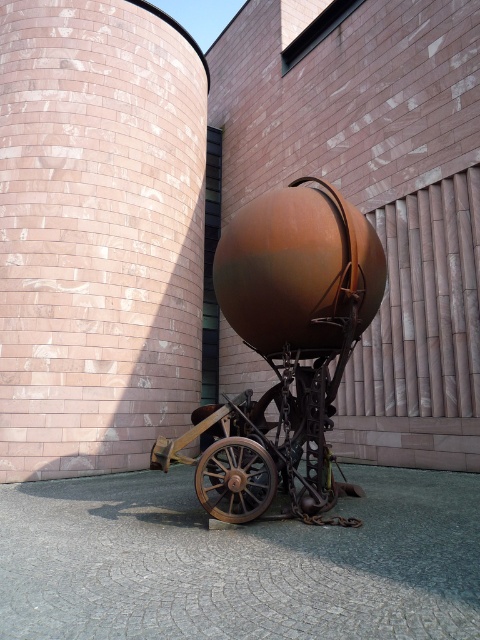
You are an architect designing a new plaza and want to place a new bench between the rustic brick pillar at center and the rusty metal sphere at center. Based on their widths, which object should the bench be closer to?

The bench should be closer to the rusty metal sphere at center because the rustic brick pillar at center might be wider, requiring more space between them.

Consider the image. You are an artist standing in front of the sculpture. You need to place a small decorative item on the object that is higher up. Which object should you choose between the rusty metal wagon at center and the rustic wood wheel at lower center?

The rusty metal wagon at center is above the rustic wood wheel at lower center, so you should place the decorative item on the rusty metal wagon at center.

You are standing 10 feet away from the sculpture and want to take a closer look. If you move forward 1 foot, will you be closer to the rusty metal sphere at center than the camera is?

The rusty metal sphere at center is currently 9.02 feet away from the camera. If you move forward 1 foot from your current position 10 feet away, you will be 9 feet away from the sphere, which is closer than the camera.